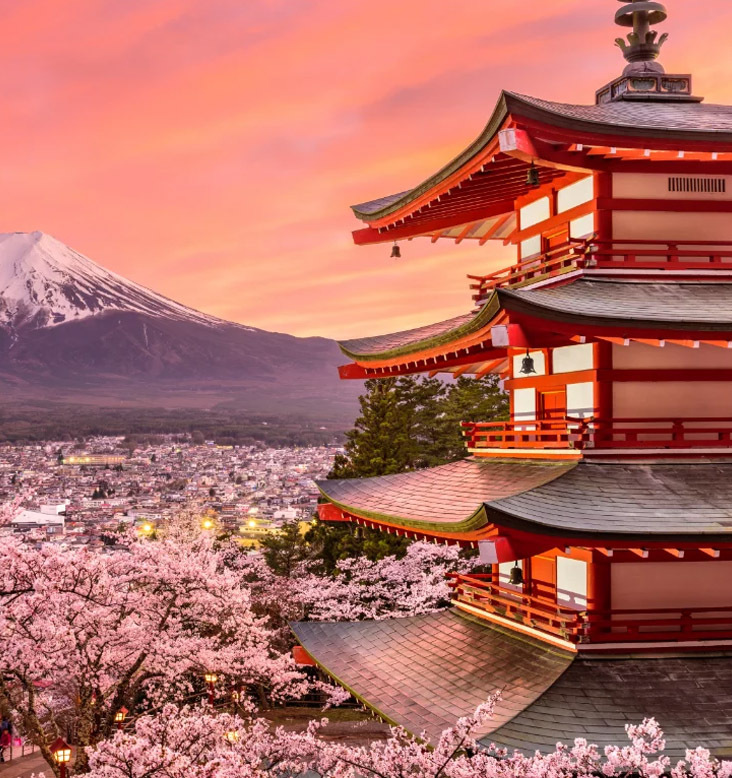
At what (x,y) coordinates should I click in order to perform the action: click on vent. Please return your answer as a coordinate pair (x, y). This screenshot has width=732, height=778. Looking at the image, I should click on (703, 183).